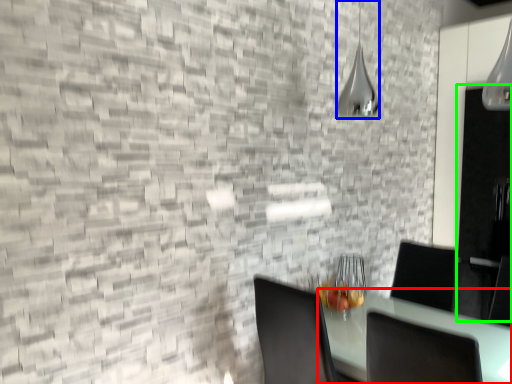
Question: Which is farther away from table (highlighted by a red box)? lamp (highlighted by a blue box) or glass door (highlighted by a green box)?

Choices:
 (A) lamp
 (B) glass door

Answer: (A)